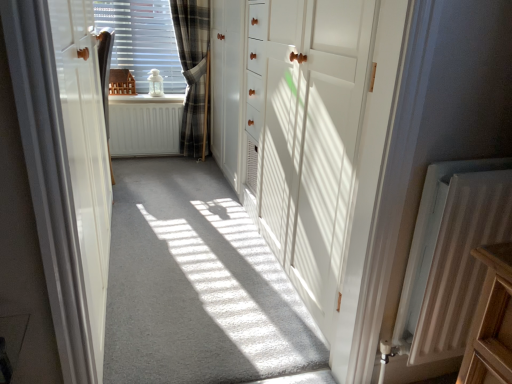
Question: Is plaid fabric curtain at center, which appears as the 1th curtain when viewed from the right, far away from white carpet at center?

Choices:
 (A) no
 (B) yes

Answer: (B)

Question: Is plaid fabric curtain at center, which appears as the 1th curtain when viewed from the right, surrounding white carpet at center?

Choices:
 (A) no
 (B) yes

Answer: (A)

Question: Is plaid fabric curtain at center, which appears as the 2th curtain when viewed from the front, facing towards white carpet at center?

Choices:
 (A) no
 (B) yes

Answer: (B)

Question: From the image's perspective, would you say plaid fabric curtain at center, which is the 1th curtain in back-to-front order, is shown under white carpet at center?

Choices:
 (A) yes
 (B) no

Answer: (B)

Question: Considering the relative sizes of plaid fabric curtain at center, which is the 2th curtain from left to right, and white carpet at center in the image provided, is plaid fabric curtain at center, which is the 2th curtain from left to right, thinner than white carpet at center?

Choices:
 (A) no
 (B) yes

Answer: (B)

Question: From a real-world perspective, is plaid fabric curtain at center, which appears as the 1th curtain when viewed from the right, on top of white carpet at center?

Choices:
 (A) yes
 (B) no

Answer: (A)

Question: Could you tell me if white wood door at center, the 2th door from the left, is facing white matte radiator at center, the 2th radiator when ordered from front to back?

Choices:
 (A) yes
 (B) no

Answer: (A)

Question: Can you confirm if white wood door at center, the 2th door from the left, is bigger than white matte radiator at center, which ranks as the second radiator in bottom-to-top order?

Choices:
 (A) yes
 (B) no

Answer: (A)

Question: Is white wood door at center, the first door viewed from the right, next to white matte radiator at center, the 1th radiator viewed from the left, and touching it?

Choices:
 (A) no
 (B) yes

Answer: (A)

Question: Does white wood door at center, the first door viewed from the right, lie behind white matte radiator at center, which is the first radiator in back-to-front order?

Choices:
 (A) no
 (B) yes

Answer: (A)

Question: Is white wood door at center, the first door viewed from the right, far away from white matte radiator at center, the first radiator viewed from the top?

Choices:
 (A) yes
 (B) no

Answer: (A)

Question: From a real-world perspective, is white wood door at center, the 2th door from the left, positioned under white matte radiator at center, the first radiator viewed from the top, based on gravity?

Choices:
 (A) yes
 (B) no

Answer: (B)

Question: Is white textured radiator at lower right, which is the 2th radiator in back-to-front order, wider than plaid fabric curtain at center, which appears as the 2th curtain when viewed from the front?

Choices:
 (A) no
 (B) yes

Answer: (A)